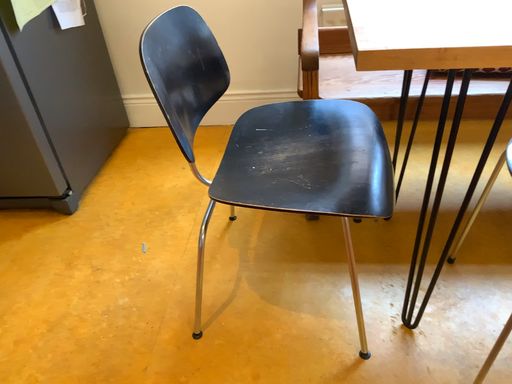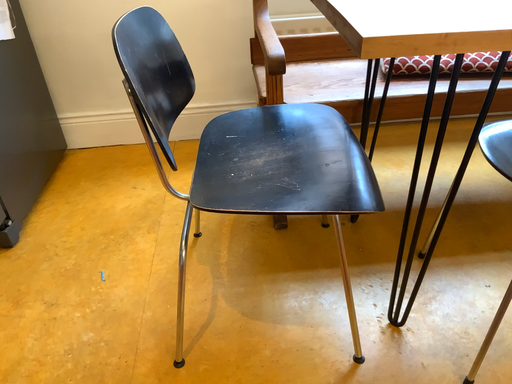
Question: How did the camera likely rotate when shooting the video?

Choices:
 (A) rotated left
 (B) rotated right

Answer: (B)